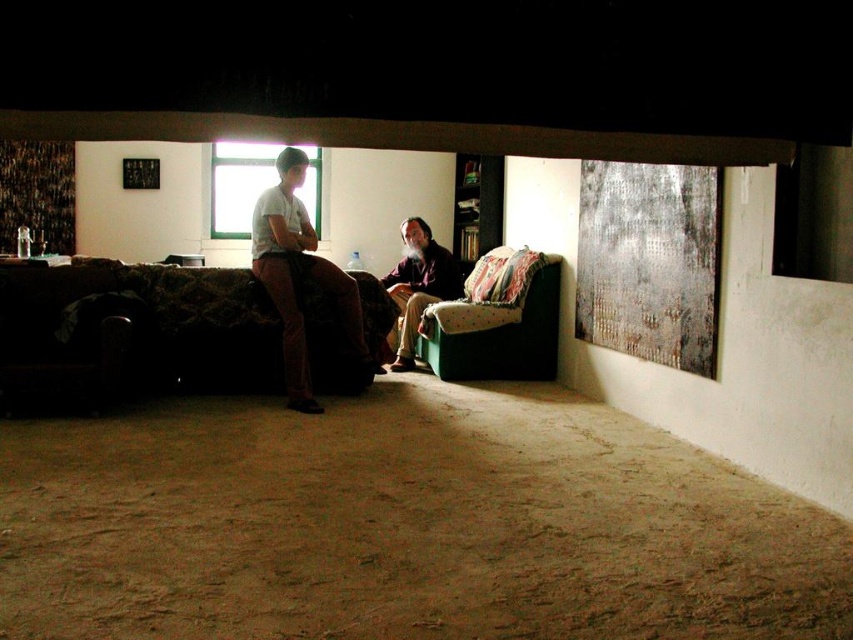
Question: Which object is farther from the camera taking this photo?

Choices:
 (A) velvet green armchair at center
 (B) matte white shirt at center
 (C) beige fabric couch at center
 (D) dark fabric couch at center

Answer: (C)

Question: Does velvet green armchair at center appear on the right side of beige fabric couch at center?

Choices:
 (A) no
 (B) yes

Answer: (B)

Question: Based on their relative distances, which object is farther from the matte white shirt at center?

Choices:
 (A) beige fabric couch at center
 (B) velvet green armchair at center

Answer: (A)

Question: Does matte white shirt at center have a greater width compared to beige fabric couch at center?

Choices:
 (A) yes
 (B) no

Answer: (A)

Question: Is dark fabric couch at center thinner than beige fabric couch at center?

Choices:
 (A) yes
 (B) no

Answer: (B)

Question: Which of the following is the farthest from the observer?

Choices:
 (A) matte white shirt at center
 (B) velvet green armchair at center

Answer: (B)